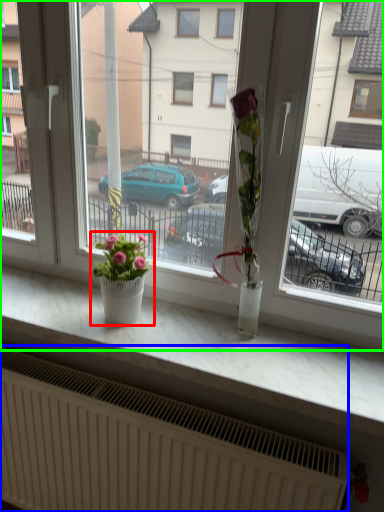
Question: Estimate the real-world distances between objects in this image. Which object is closer to houseplant (highlighted by a red box), radiator (highlighted by a blue box) or window (highlighted by a green box)?

Choices:
 (A) radiator
 (B) window

Answer: (B)